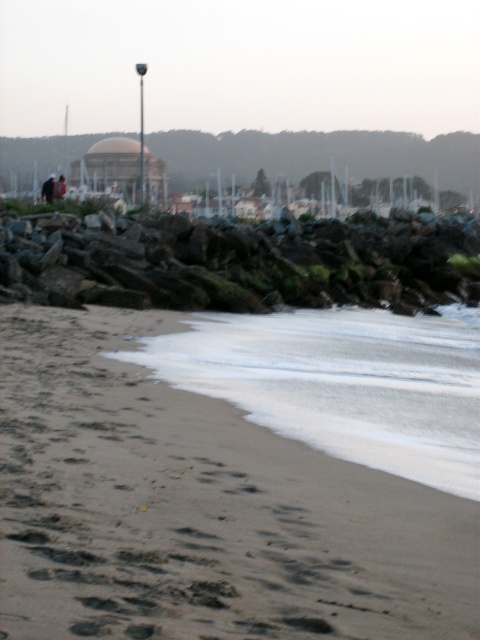
Which is in front, point (257, 339) or point (51, 188)?

Point (257, 339)

Is the position of white foam water at lower center less distant than that of dark brown leather jacket at lower left?

Yes.

Between point (346, 358) and point (48, 192), which one is positioned in front?

Point (346, 358) is more forward.

Where is `white foam water at lower center`? Image resolution: width=480 pixels, height=640 pixels. white foam water at lower center is located at coordinates point(344,381).

Is dark gray rough rocks at center behind dark brown leather jacket at center?

No.

Does dark gray rough rocks at center appear under dark brown leather jacket at center?

Yes, dark gray rough rocks at center is below dark brown leather jacket at center.

Does point (362, 234) lie behind point (64, 177)?

No, it is in front of (64, 177).

The image size is (480, 640). I want to click on dark gray rough rocks at center, so click(x=240, y=260).

Describe the element at coordinates (199, 508) in the screenshot. The height and width of the screenshot is (640, 480). I see `sandy brown at lower left` at that location.

Does sandy brown at lower left appear on the right side of dark gray rough rocks at center?

In fact, sandy brown at lower left is to the left of dark gray rough rocks at center.

What are the coordinates of `sandy brown at lower left` in the screenshot? It's located at (199, 508).